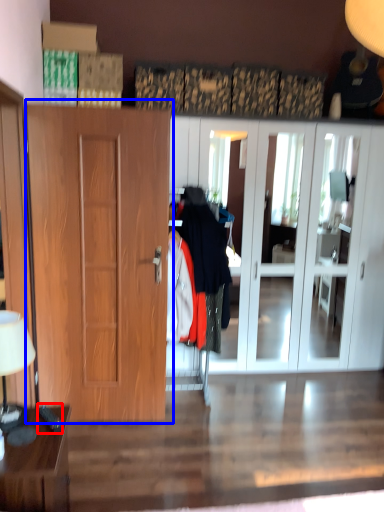
Question: Among these objects, which one is farthest to the camera, remote control (highlighted by a red box) or door (highlighted by a blue box)?

Choices:
 (A) remote control
 (B) door

Answer: (B)